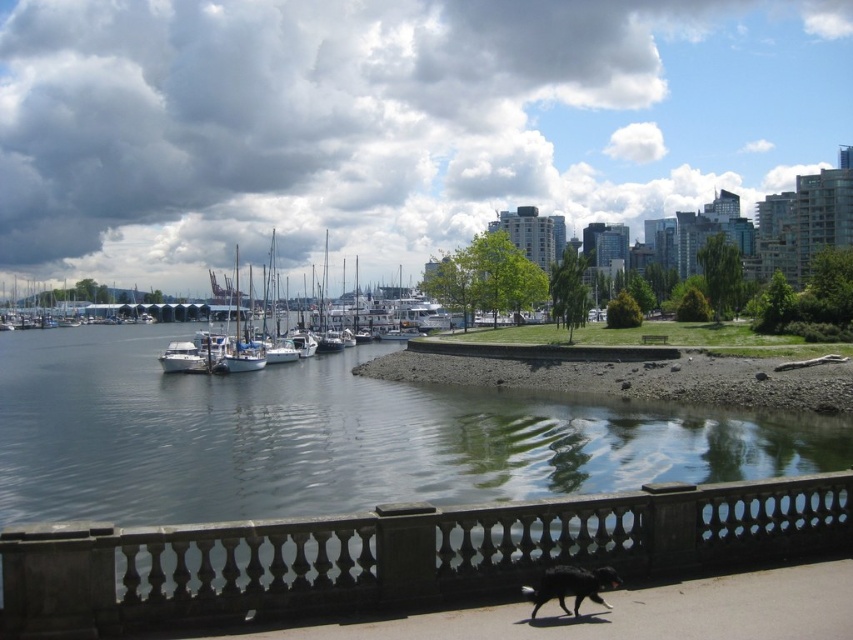
How distant is white matte boats at center from black fur dog at lower center?

The distance of white matte boats at center from black fur dog at lower center is 58.03 meters.

From the picture: Is white matte boats at center smaller than black fur dog at lower center?

No, white matte boats at center is not smaller than black fur dog at lower center.

This screenshot has height=640, width=853. What are the coordinates of `white matte boats at center` in the screenshot? It's located at (219, 352).

Looking at this image, does dark gray stone railing at lower center appear on the left side of black fur dog at lower center?

Incorrect, dark gray stone railing at lower center is not on the left side of black fur dog at lower center.

Who is more distant from viewer, (454, 586) or (554, 572)?

Point (454, 586)

Where is `dark gray stone railing at lower center`? dark gray stone railing at lower center is located at coordinates (399, 556).

Is dark gray stone railing at lower center positioned before white matte boats at center?

Yes, it is in front of white matte boats at center.

Can you confirm if dark gray stone railing at lower center is wider than white matte boats at center?

No.

Locate an element on the screen. dark gray stone railing at lower center is located at coordinates (399, 556).